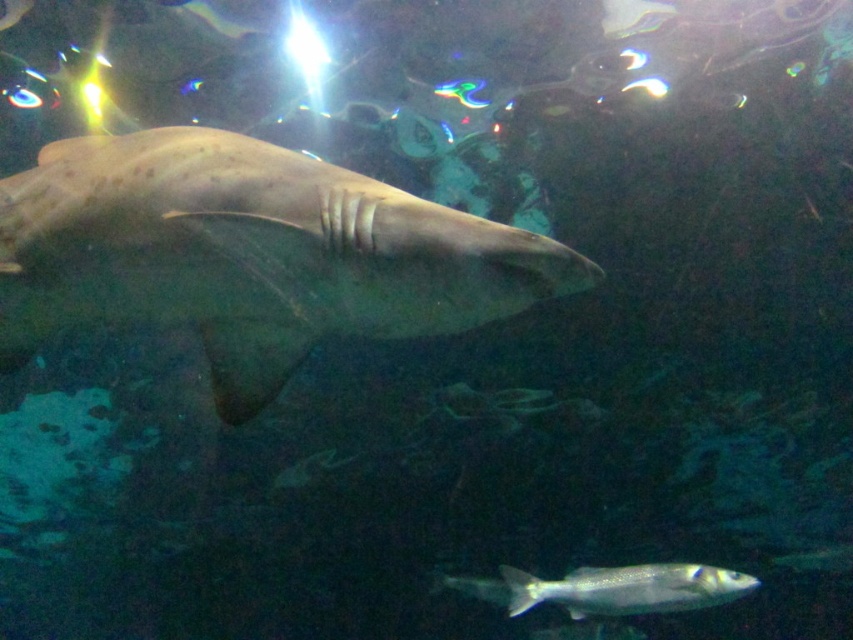
You are a scuba diver observing the underwater scene. You notice the speckled tan shark at center and the shiny silver fish at bottom right. Which of these two marine animals is closer to you?

The speckled tan shark at center is closer to you because it is positioned in front of the shiny silver fish at bottom right.

You are a marine biologist observing the underwater scene. You notice the speckled tan shark at center and the shiny silver fish at bottom right. Which of these two marine animals is larger in size?

The speckled tan shark at center is bigger than the shiny silver fish at bottom right.

What are the coordinates of the speckled tan shark at center?

The speckled tan shark at center is located at point (x=248, y=253).